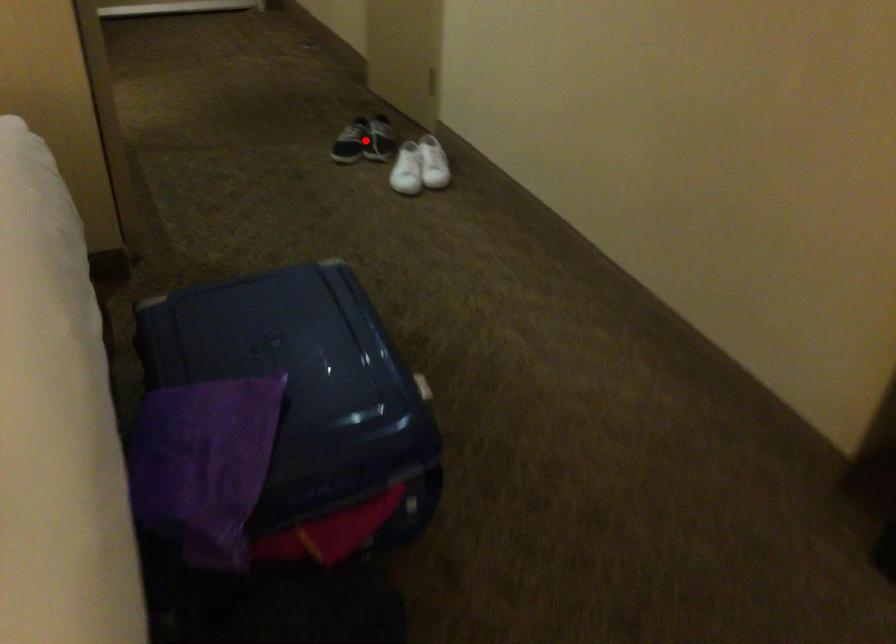
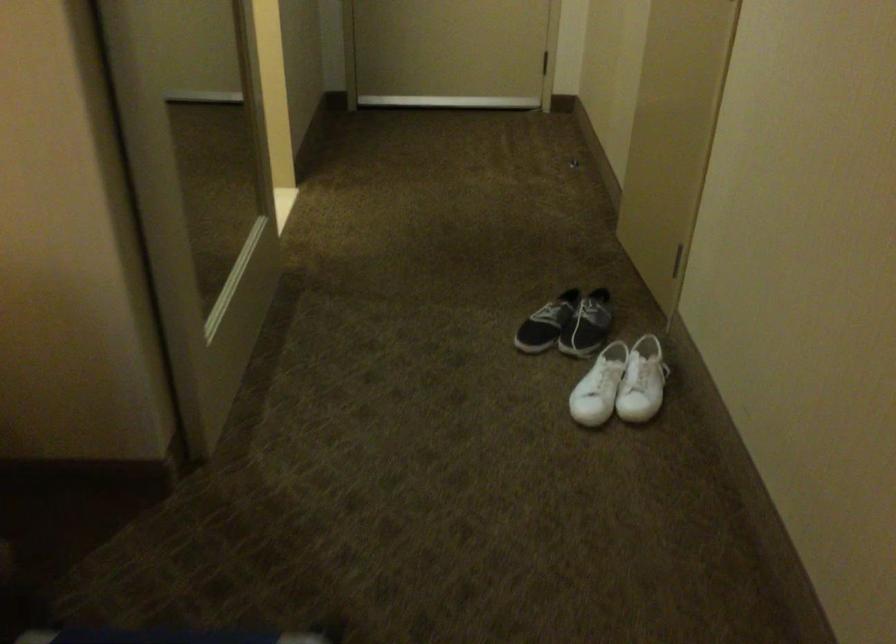
Question: I am providing you with two images of the same scene from different viewpoints. Given a red point in image1, look at the same physical point in image2. Is it:

Choices:
 (A) Closer to the viewpoint
 (B) Farther from the viewpoint

Answer: (A)